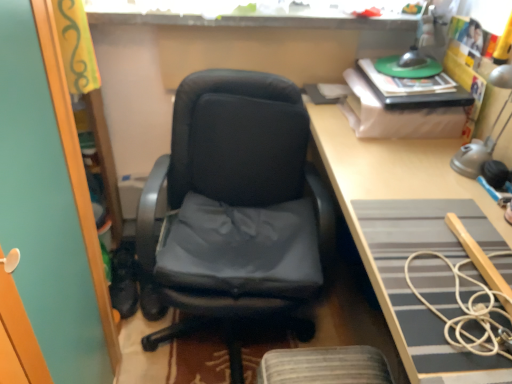
Question: From the image's perspective, does white cord at right appear higher than metallic silver table lamp at upper right?

Choices:
 (A) yes
 (B) no

Answer: (B)

Question: Is white cord at right outside of metallic silver table lamp at upper right?

Choices:
 (A) no
 (B) yes

Answer: (B)

Question: Is white cord at right surrounding metallic silver table lamp at upper right?

Choices:
 (A) no
 (B) yes

Answer: (A)

Question: From a real-world perspective, is white cord at right physically above metallic silver table lamp at upper right?

Choices:
 (A) no
 (B) yes

Answer: (A)

Question: Considering the relative sizes of white cord at right and metallic silver table lamp at upper right in the image provided, is white cord at right taller than metallic silver table lamp at upper right?

Choices:
 (A) no
 (B) yes

Answer: (A)

Question: From a real-world perspective, is white cord at right above or below metallic silver table lamp at upper right?

Choices:
 (A) below
 (B) above

Answer: (A)

Question: Would you say white cord at right is to the left or to the right of metallic silver table lamp at upper right in the picture?

Choices:
 (A) right
 (B) left

Answer: (B)

Question: Would you say white cord at right is inside or outside metallic silver table lamp at upper right?

Choices:
 (A) inside
 (B) outside

Answer: (B)

Question: Is white cord at right bigger or smaller than metallic silver table lamp at upper right?

Choices:
 (A) big
 (B) small

Answer: (B)

Question: Is metallic silver table lamp at upper right situated inside matte black office chair at center or outside?

Choices:
 (A) inside
 (B) outside

Answer: (B)

Question: Is metallic silver table lamp at upper right to the left or to the right of matte black office chair at center in the image?

Choices:
 (A) right
 (B) left

Answer: (A)

Question: Is metallic silver table lamp at upper right taller or shorter than matte black office chair at center?

Choices:
 (A) tall
 (B) short

Answer: (B)

Question: In terms of width, does metallic silver table lamp at upper right look wider or thinner when compared to matte black office chair at center?

Choices:
 (A) wide
 (B) thin

Answer: (B)

Question: Is metallic silver table lamp at upper right taller or shorter than white cord at right?

Choices:
 (A) tall
 (B) short

Answer: (A)

Question: Would you say metallic silver table lamp at upper right is to the left or to the right of white cord at right in the picture?

Choices:
 (A) left
 (B) right

Answer: (B)